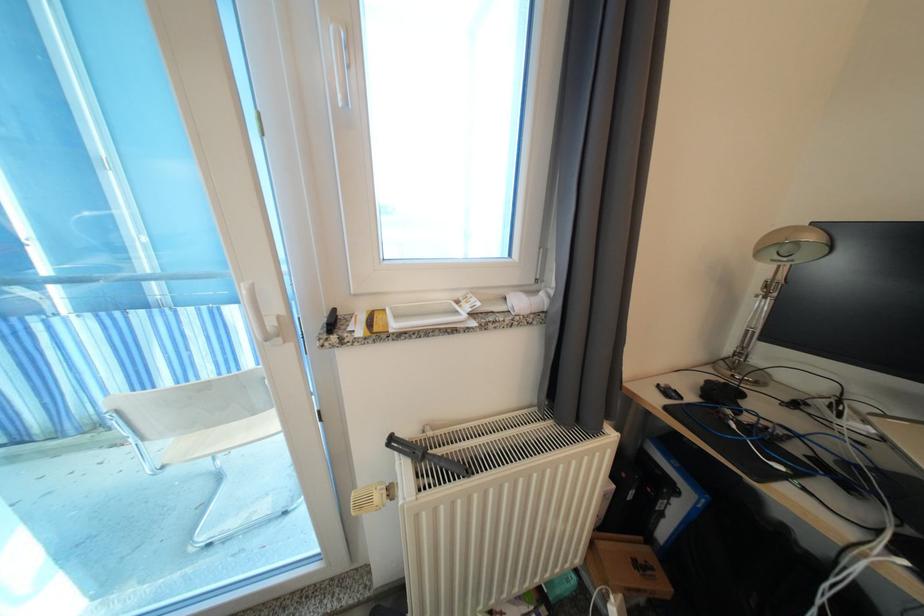
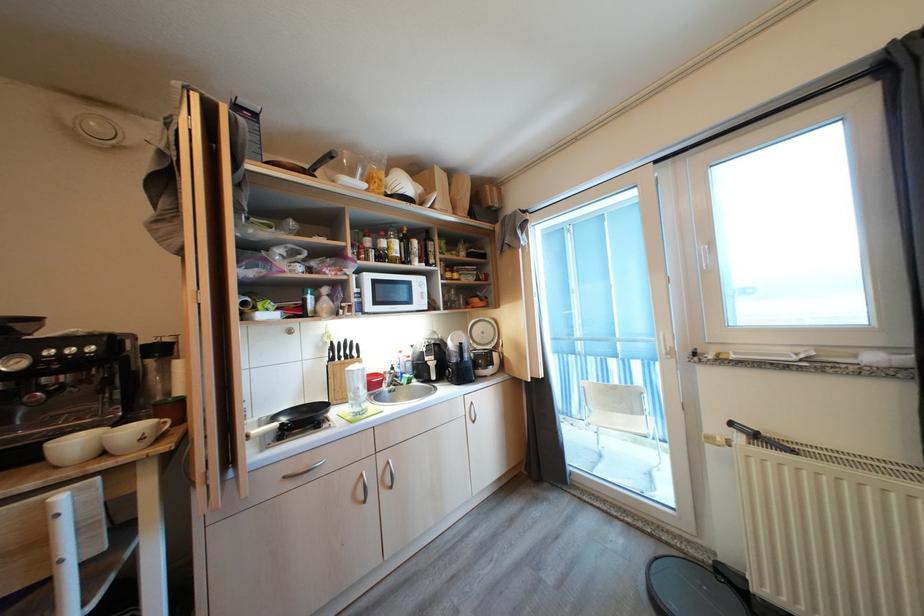
Where in the second image is the point corresponding to [259,416] from the first image?

(637, 416)